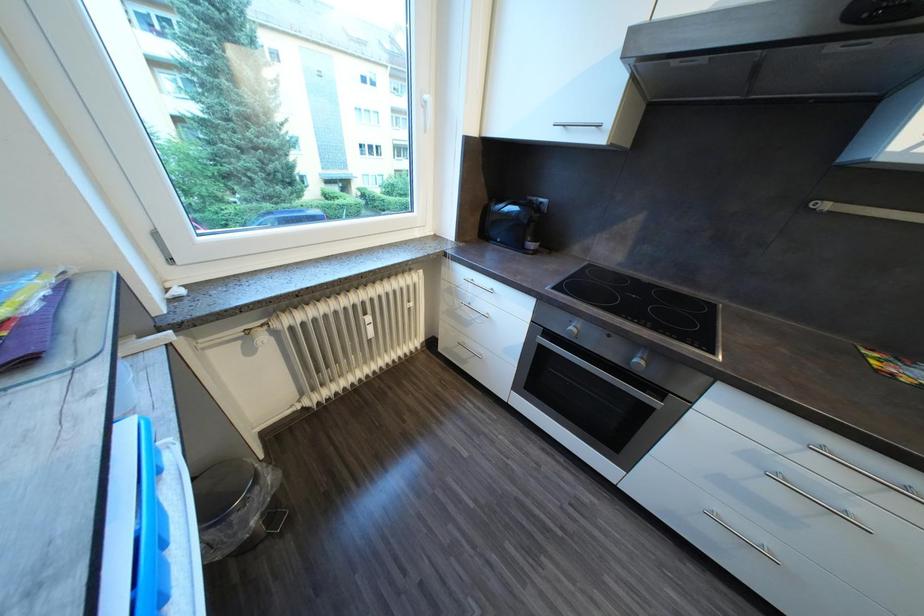
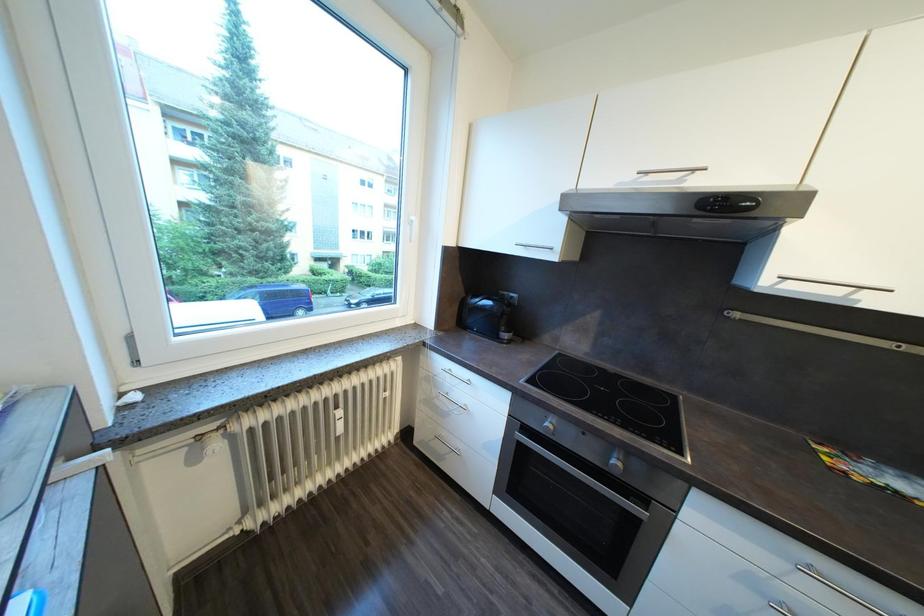
Question: What movement of the cameraman would produce the second image?

Choices:
 (A) Left
 (B) Right
 (C) Forward
 (D) Backward

Answer: (D)